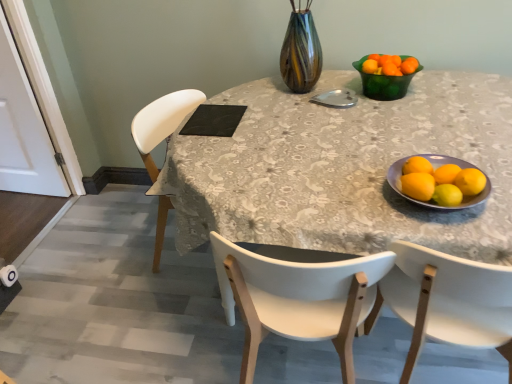
The width and height of the screenshot is (512, 384). In order to click on unoccupied space behind black matte placemat at upper center in this screenshot , I will do point(218,100).